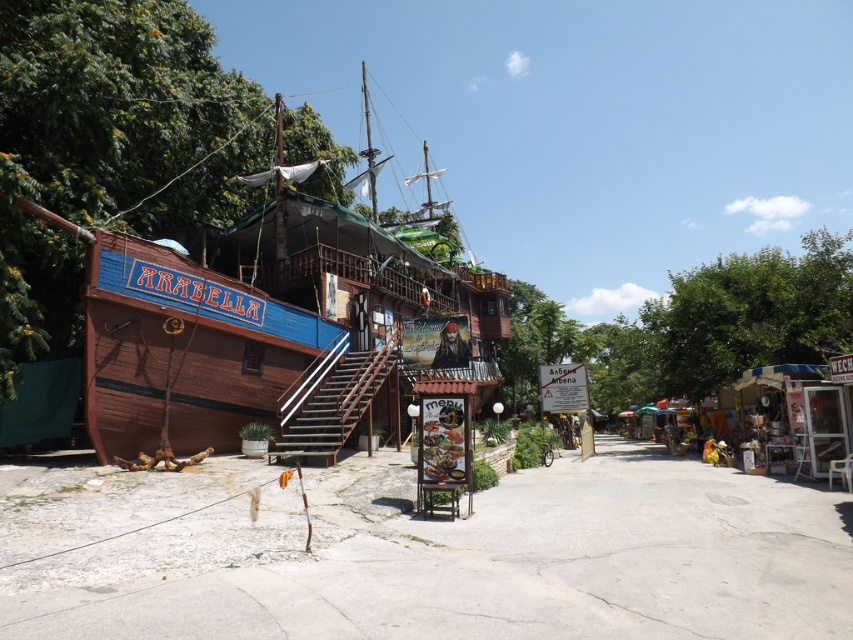
You are navigating a drone over the tropical street scene. The drone is programmed to hover exactly at the center point of the image, which is at coordinates 0.5, 0.5. Can the drone safely hover above the wooden pirate ship at center without deviating from its programmed path?

The wooden pirate ship at center is located at point [264,328], which is slightly to the right and below the image center at [426,320]. Therefore, the drone will not be able to hover above the wooden pirate ship at center while staying at the exact center coordinates.

You are standing at point (264,328) in the scene. What object is directly under your feet?

The wooden pirate ship at center is located at point (264,328), so the object directly under your feet is the wooden pirate ship at center.